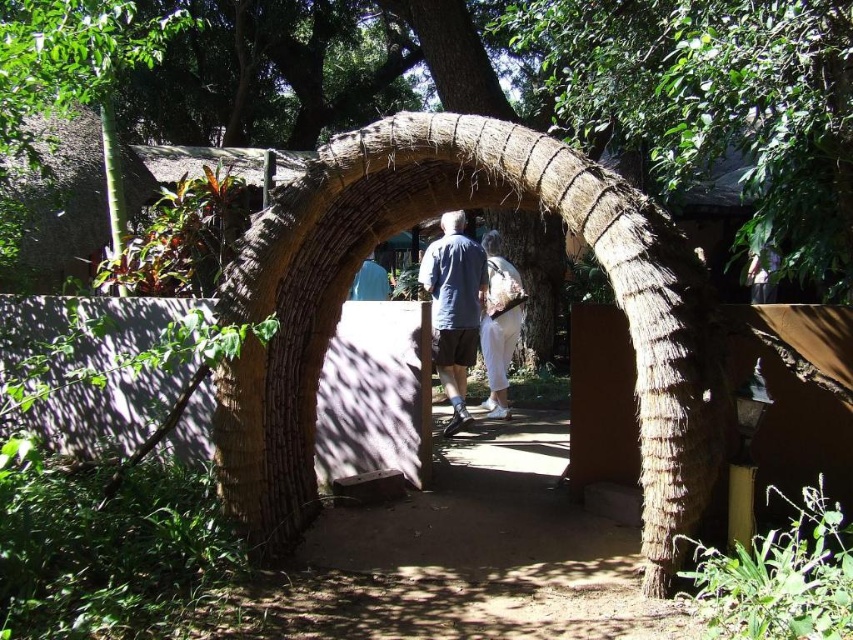
Question: Considering the relative positions of natural thatched arch at center and white cotton pants at center in the image provided, where is natural thatched arch at center located with respect to white cotton pants at center?

Choices:
 (A) above
 (B) below

Answer: (B)

Question: Which is nearer to the light blue fabric at center?

Choices:
 (A) matte blue shirt at center
 (B) natural thatched arch at center
 (C) white cotton pants at center

Answer: (A)

Question: Is natural thatched arch at center below white cotton pants at center?

Choices:
 (A) no
 (B) yes

Answer: (B)

Question: Which point is closer to the camera taking this photo?

Choices:
 (A) (651, 200)
 (B) (451, 301)
 (C) (498, 285)
 (D) (372, 266)

Answer: (A)

Question: Does matte blue shirt at center have a larger size compared to light blue fabric at center?

Choices:
 (A) yes
 (B) no

Answer: (A)

Question: Among these objects, which one is farthest from the camera?

Choices:
 (A) matte blue shirt at center
 (B) white cotton pants at center
 (C) light blue fabric at center
 (D) natural thatched arch at center

Answer: (C)